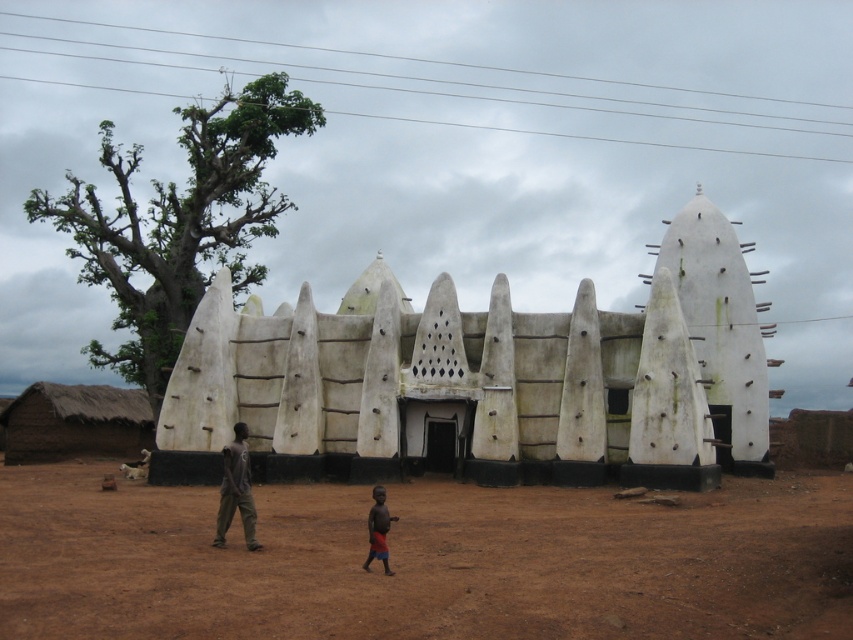
Question: Which object is closer to the camera taking this photo?

Choices:
 (A) reddish-brown fabric shorts at lower center
 (B) gray matte shirt at center
 (C) white mud building at center
 (D) brown dirt field at center

Answer: (D)

Question: Can you confirm if brown thatch hut at lower left is bigger than gray matte shirt at center?

Choices:
 (A) yes
 (B) no

Answer: (A)

Question: Can you confirm if brown dirt field at center is positioned to the left of reddish-brown fabric shorts at lower center?

Choices:
 (A) no
 (B) yes

Answer: (A)

Question: Which point is closer to the camera taking this photo?

Choices:
 (A) (381, 500)
 (B) (224, 484)
 (C) (13, 424)

Answer: (A)

Question: Which point is farther from the camera taking this photo?

Choices:
 (A) (241, 448)
 (B) (387, 564)
 (C) (114, 406)
 (D) (473, 621)

Answer: (C)

Question: Is brown thatch hut at lower left below gray matte shirt at center?

Choices:
 (A) yes
 (B) no

Answer: (B)